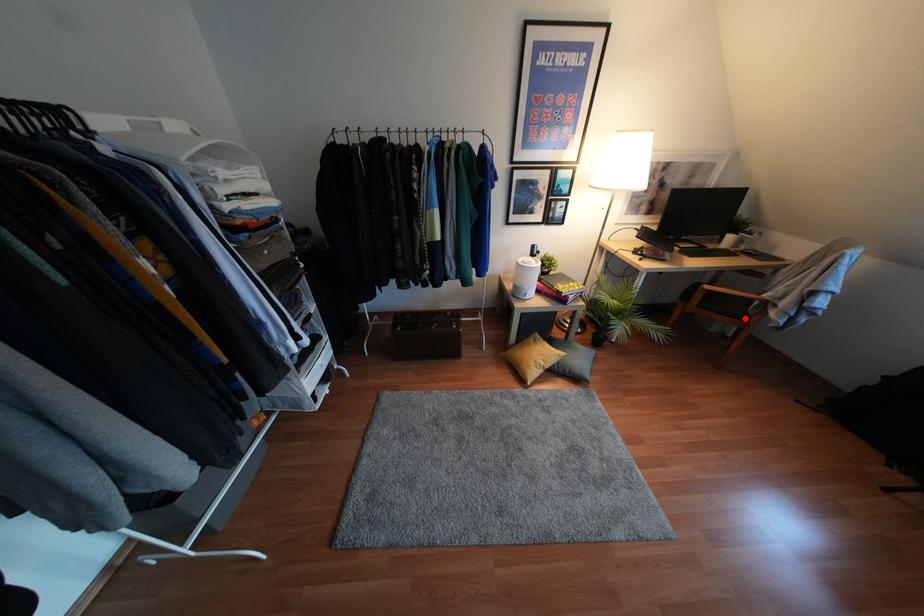
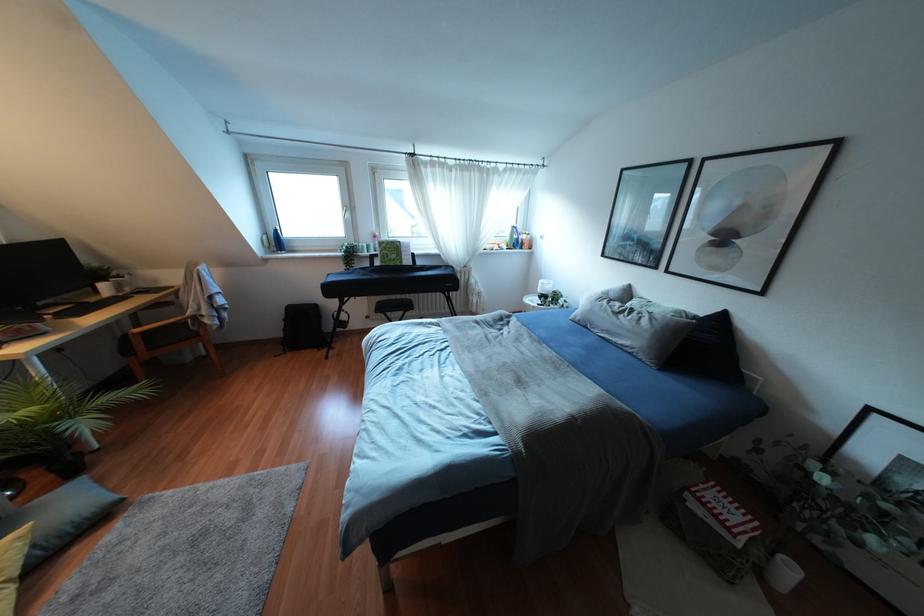
Where in the second image is the point corresponding to the highlighted location from the first image?

(196, 334)